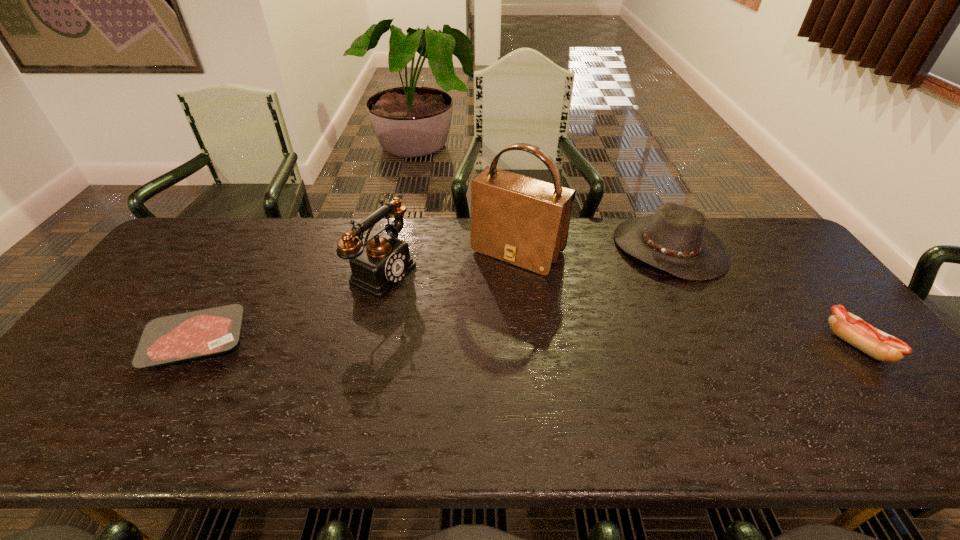
You are a GUI agent. You are given a task and a screenshot of the screen. Output one action in this format:
    pyautogui.click(x=<x>, y=<y>)
    Task: Click on the blank space located on the front of the second object from left to right at the rotary dial
    
    Given the screenshot: What is the action you would take?
    pyautogui.click(x=440, y=300)

Image resolution: width=960 pixels, height=540 pixels. I want to click on shoulder bag at the far edge, so click(524, 221).

This screenshot has height=540, width=960. I want to click on hat at the far edge, so click(x=675, y=239).

Find the location of `telephone situated at the far edge`. telephone situated at the far edge is located at coordinates (384, 261).

Locate an element on the screen. The height and width of the screenshot is (540, 960). object situated at the near edge is located at coordinates (175, 338).

The width and height of the screenshot is (960, 540). In order to click on object present at the left edge in this screenshot , I will do `click(175, 338)`.

Image resolution: width=960 pixels, height=540 pixels. Find the location of `object that is at the right edge`. object that is at the right edge is located at coordinates (881, 346).

Where is `object located in the near left corner section of the desktop`? The image size is (960, 540). object located in the near left corner section of the desktop is located at coordinates (175, 338).

At what (x,y) coordinates should I click in order to perform the action: click on free space at the far edge. Please return your answer as a coordinate pair (x, y). Looking at the image, I should click on (607, 255).

The width and height of the screenshot is (960, 540). Identify the location of blank space at the near edge of the desktop. (446, 379).